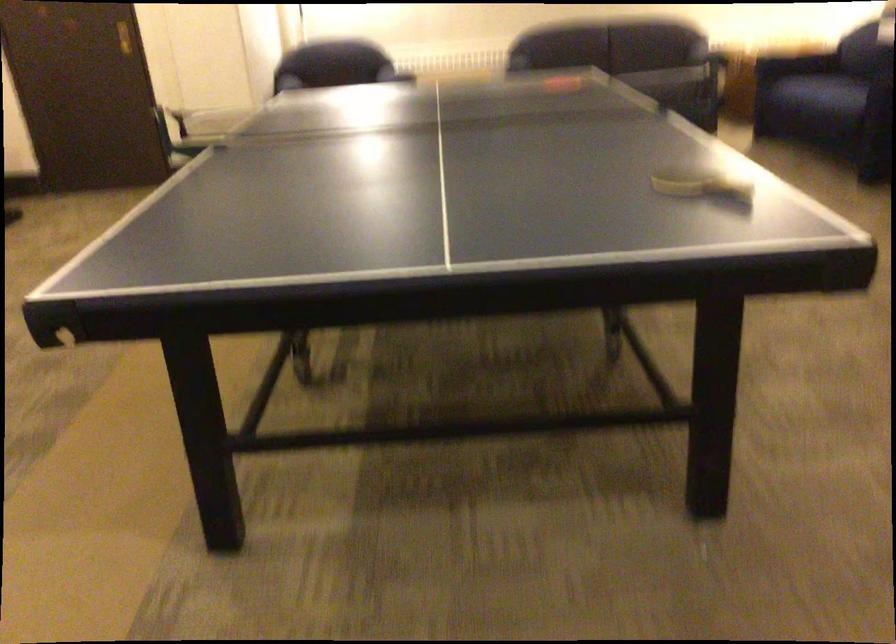
The height and width of the screenshot is (644, 896). What do you see at coordinates (668, 82) in the screenshot?
I see `a sofa sitting surface` at bounding box center [668, 82].